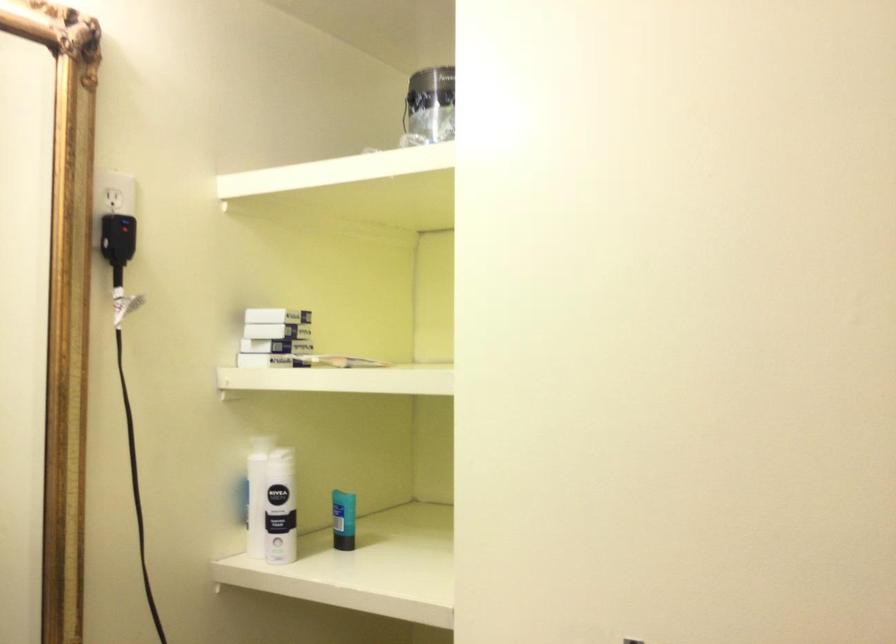
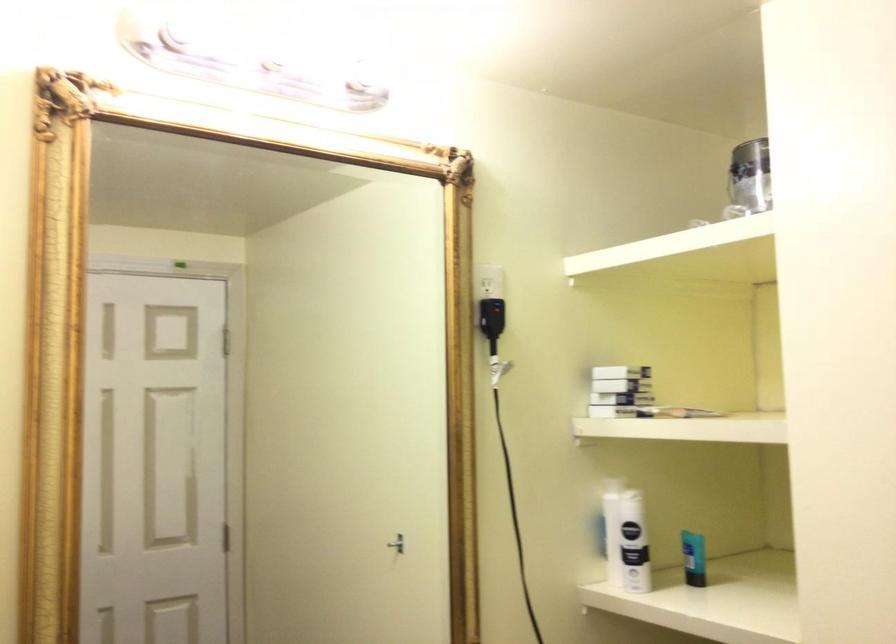
Question: The camera is either moving clockwise (left) or counter-clockwise (right) around the object. The first image is from the beginning of the video and the second image is from the end. Is the camera moving left or right when shooting the video?

Choices:
 (A) Left
 (B) Right

Answer: (B)